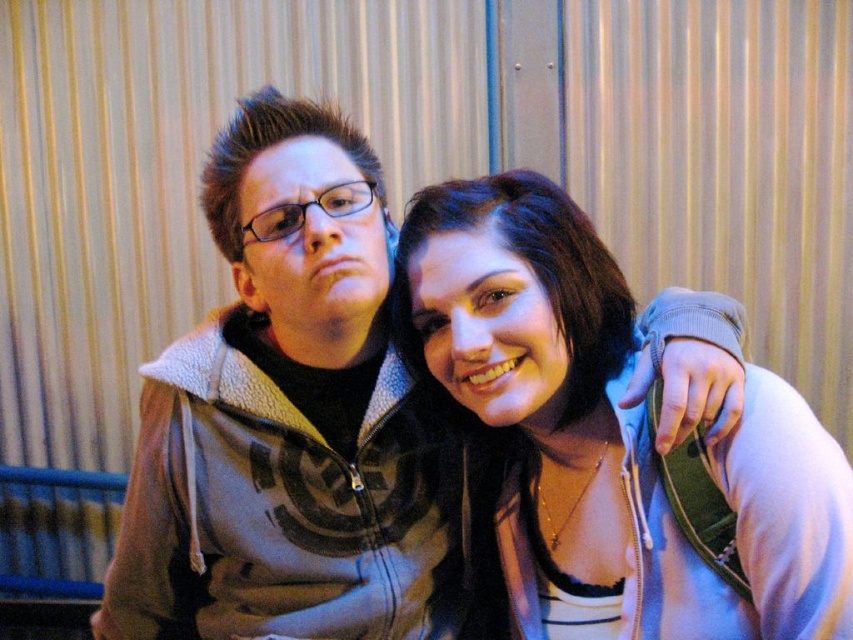
Between gray fleece hoodie at center and matte gray hoodie at center, which one has more height?

Standing taller between the two is gray fleece hoodie at center.

Is point (209, 499) positioned after point (511, 451)?

No, (209, 499) is closer to viewer.

Identify the location of gray fleece hoodie at center. Image resolution: width=853 pixels, height=640 pixels. (288, 419).